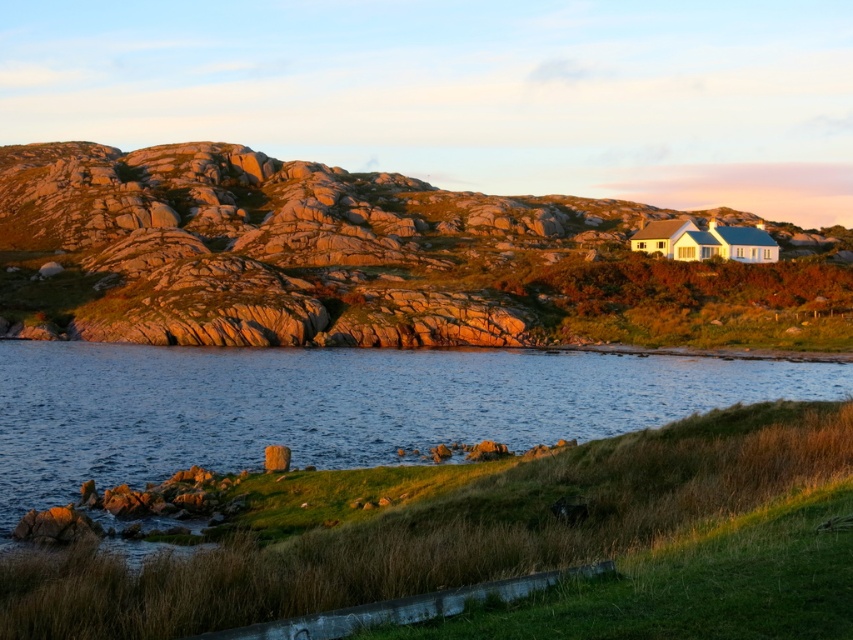
You are a hiker planning to take a photo of the smooth gray rock at lower left and the rough stone hillside at upper center. Which object should you position closer to the camera to ensure both are in focus?

You should position the smooth gray rock at lower left closer to the camera because it is shorter than the rough stone hillside at upper center, allowing both to be in focus.

You are a hiker standing at the smooth gray rock at lower left and want to reach the rough stone hillside at upper center. Based on the scene description, which direction should you head to move towards it?

The rough stone hillside at upper center is positioned over the smooth gray rock at lower left, so you should head upward to reach it.